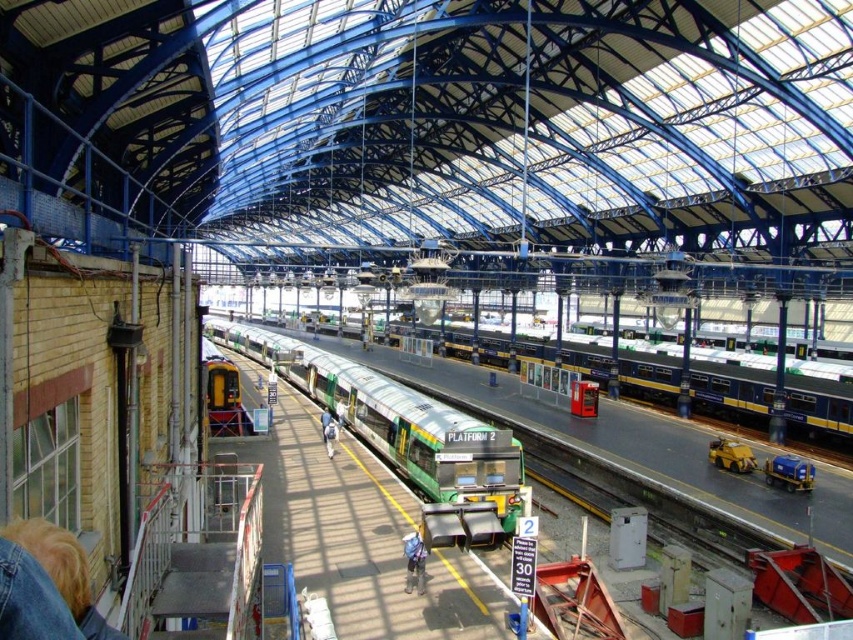
Does blue denim jacket at center lie behind blue fabric backpack at center?

That is False.

You are a GUI agent. You are given a task and a screenshot of the screen. Output one action in this format:
    pyautogui.click(x=<x>, y=<y>)
    Task: Click on the blue denim jacket at center
    
    Given the screenshot: What is the action you would take?
    pyautogui.click(x=329, y=435)

Where is `blue denim jacket at center`? Image resolution: width=853 pixels, height=640 pixels. blue denim jacket at center is located at coordinates (329, 435).

Does blonde hair at lower left lie behind blue fabric backpack at center?

No, it is in front of blue fabric backpack at center.

Which of these two, blonde hair at lower left or blue fabric backpack at center, stands shorter?

blue fabric backpack at center is shorter.

Where is `blonde hair at lower left`? The image size is (853, 640). blonde hair at lower left is located at coordinates point(62,570).

Who is more forward, (447, 410) or (71, 550)?

Point (71, 550)

Measure the distance between point (311,384) and camera.

A distance of 45.32 meters exists between point (311,384) and camera.

Measure the distance between point (387, 435) and camera.

Point (387, 435) and camera are 95.48 feet apart.

Locate an element on the screen. This screenshot has height=640, width=853. green metallic train at center is located at coordinates (405, 432).